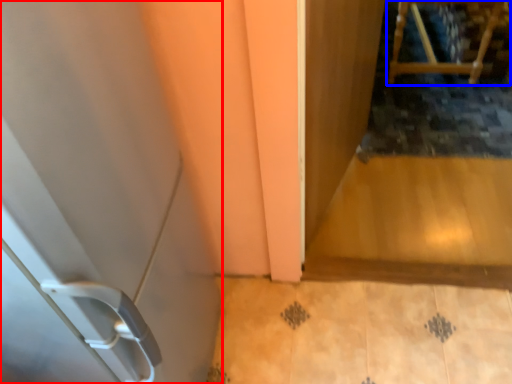
Question: Which of the following is the closest to the observer, door (highlighted by a red box) or furniture (highlighted by a blue box)?

Choices:
 (A) door
 (B) furniture

Answer: (A)